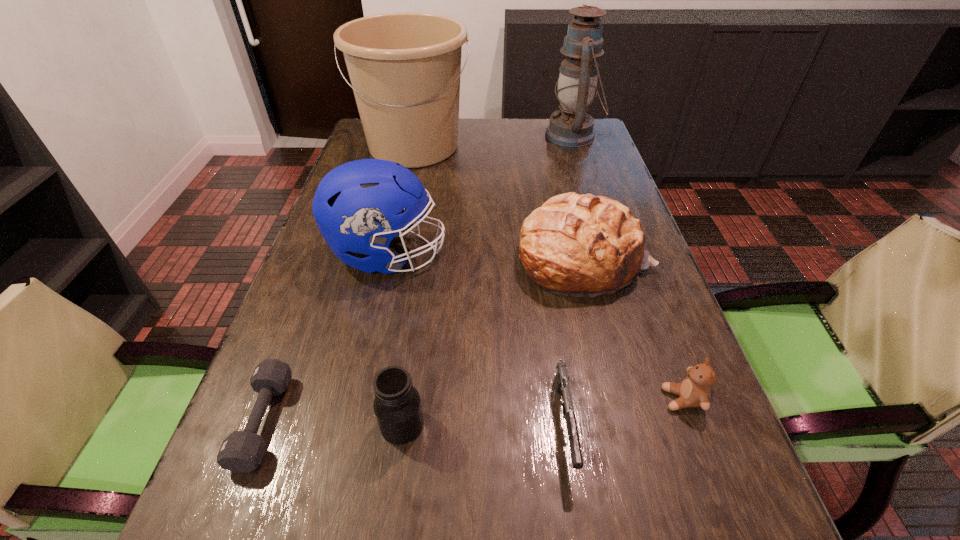
What are the coordinates of `bucket that is positioned at the left edge` in the screenshot? It's located at (405, 68).

In order to click on football helmet located at the left edge in this screenshot , I will do `click(360, 206)`.

This screenshot has height=540, width=960. I want to click on dumbbell that is at the left edge, so click(242, 451).

Where is `oil lamp that is at the right edge`? The width and height of the screenshot is (960, 540). oil lamp that is at the right edge is located at coordinates pyautogui.click(x=572, y=127).

Where is `bread located in the right edge section of the desktop`? Image resolution: width=960 pixels, height=540 pixels. bread located in the right edge section of the desktop is located at coordinates (584, 245).

You are a GUI agent. You are given a task and a screenshot of the screen. Output one action in this format:
    pyautogui.click(x=<x>, y=<y>)
    Task: Click on the teddy bear at the right edge
    
    Given the screenshot: What is the action you would take?
    pyautogui.click(x=694, y=391)

Identify the location of object that is at the far left corner. The height and width of the screenshot is (540, 960). (405, 68).

Locate an element on the screen. This screenshot has width=960, height=540. object that is at the far right corner is located at coordinates (572, 127).

In order to click on vacant space at the far edge of the desktop in this screenshot , I will do `click(519, 121)`.

Find the location of a particular element. vacant region at the left edge is located at coordinates (320, 282).